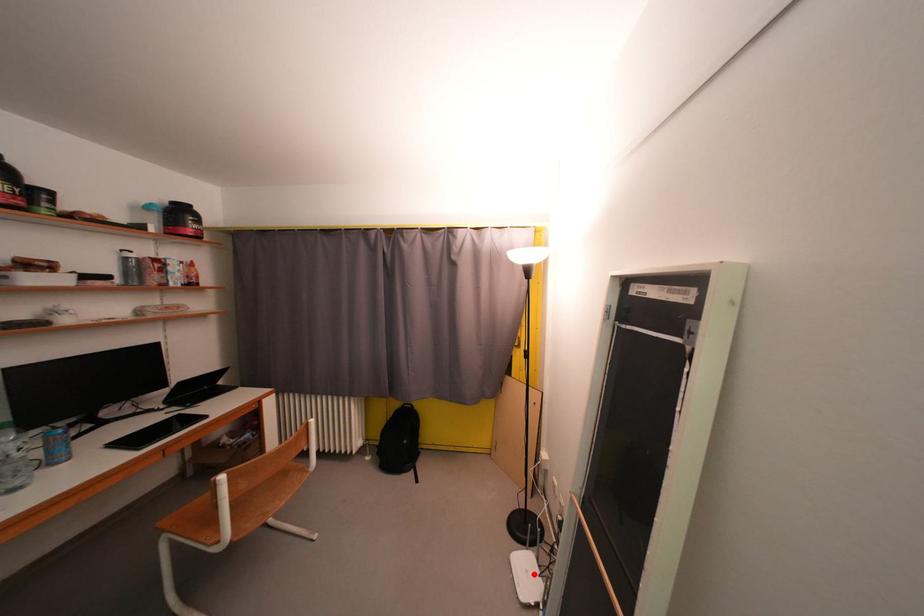
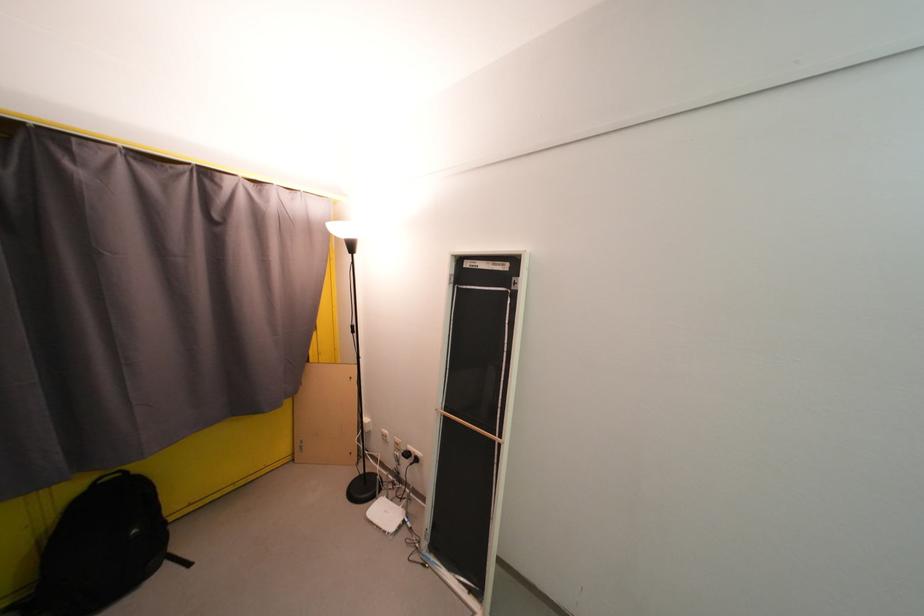
In the second image, find the point that corresponds to the highlighted location in the first image.

(392, 515)